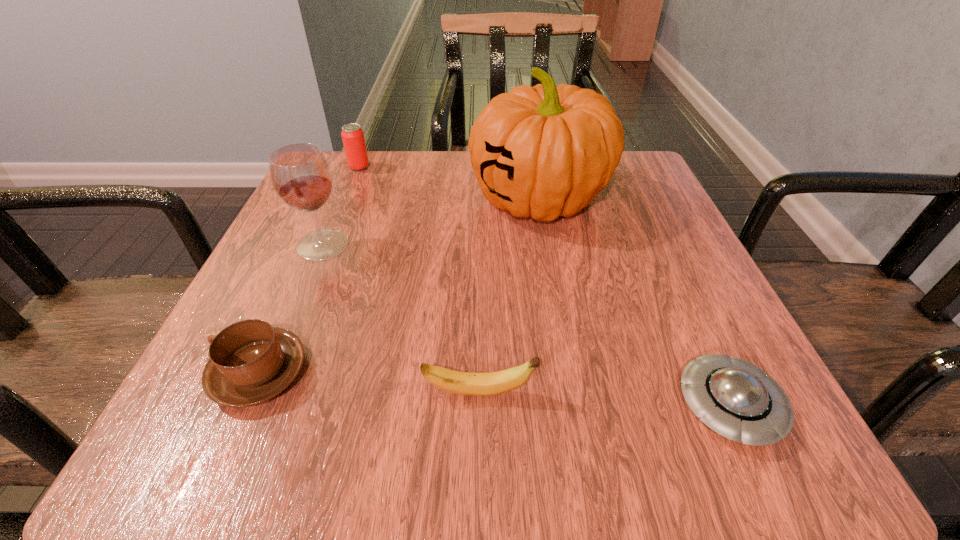
In the image, there is a desktop. Where is `vacant area at the right edge`? This screenshot has width=960, height=540. vacant area at the right edge is located at coordinates pyautogui.click(x=642, y=228).

Image resolution: width=960 pixels, height=540 pixels. I want to click on free space at the near left corner of the desktop, so click(163, 453).

Identify the location of free region at the far right corner of the desktop. (605, 209).

Find the location of `free space that is in between the banana and the third tallest object`. free space that is in between the banana and the third tallest object is located at coordinates (420, 280).

The height and width of the screenshot is (540, 960). In order to click on vacant space that is in between the third tallest object and the saucer in this screenshot , I will do `click(544, 286)`.

At what (x,y) coordinates should I click in order to perform the action: click on empty location between the banana and the pumpkin. Please return your answer as a coordinate pair (x, y). Looking at the image, I should click on (509, 296).

Locate an element on the screen. free space between the fifth shortest object and the banana is located at coordinates (401, 319).

At what (x,y) coordinates should I click in order to perform the action: click on vacant area that lies between the third tallest object and the saucer. Please return your answer as a coordinate pair (x, y). This screenshot has height=540, width=960. Looking at the image, I should click on (544, 286).

The height and width of the screenshot is (540, 960). Identify the location of vacant area that lies between the fourth shortest object and the cappuccino. (309, 270).

The width and height of the screenshot is (960, 540). I want to click on empty space between the banana and the saucer, so click(x=604, y=399).